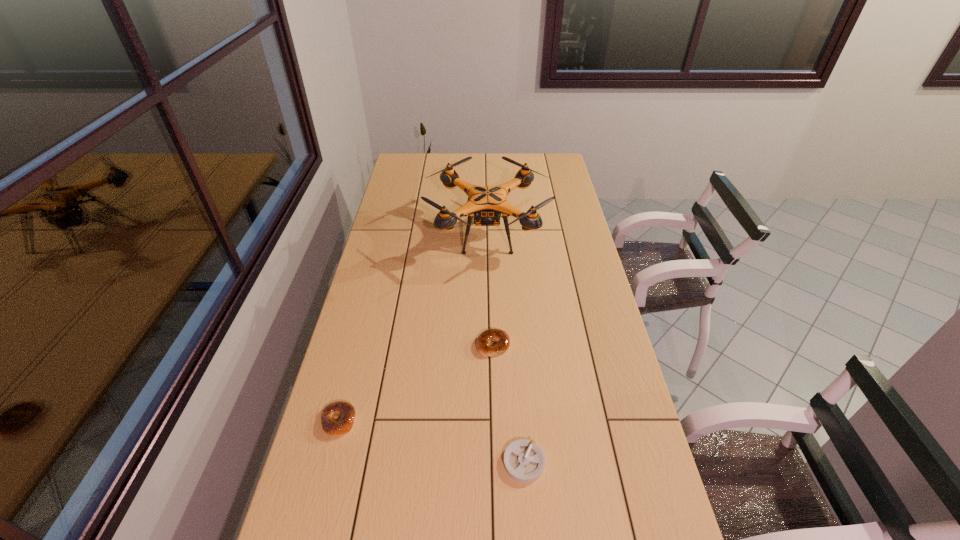
Locate an element on the screen. The image size is (960, 540). free point between the drone and the third nearest object is located at coordinates (491, 289).

The image size is (960, 540). I want to click on vacant space that is in between the third nearest object and the tallest object, so click(x=491, y=289).

This screenshot has width=960, height=540. In order to click on free space that is in between the drone and the leftmost object in this screenshot , I will do `click(413, 327)`.

Image resolution: width=960 pixels, height=540 pixels. What are the coordinates of `free space between the nearer bagel and the drone` in the screenshot? It's located at (413, 327).

Locate an element on the screen. free space between the nearest object and the second nearest object is located at coordinates (431, 441).

Where is `free spot between the drone and the leftmost object`? free spot between the drone and the leftmost object is located at coordinates (413, 327).

At what (x,y) coordinates should I click in order to perform the action: click on vacant area between the left bagel and the tallest object. Please return your answer as a coordinate pair (x, y). This screenshot has width=960, height=540. Looking at the image, I should click on (413, 327).

Identify which object is the closest to the ashtray. Please provide its 2D coordinates. Your answer should be formatted as a tuple, i.e. [(x, y)], where the tuple contains the x and y coordinates of a point satisfying the conditions above.

[(488, 336)]

Locate which object is the second closest to the second farthest object. Please provide its 2D coordinates. Your answer should be formatted as a tuple, i.e. [(x, y)], where the tuple contains the x and y coordinates of a point satisfying the conditions above.

[(487, 203)]

At what (x,y) coordinates should I click in order to perform the action: click on vacant area in the image that satisfies the following two spatial constraints: 1. on the camera mount of the tallest object; 2. on the right side of the ashtray. Please return your answer as a coordinate pair (x, y). This screenshot has height=540, width=960. Looking at the image, I should click on (492, 462).